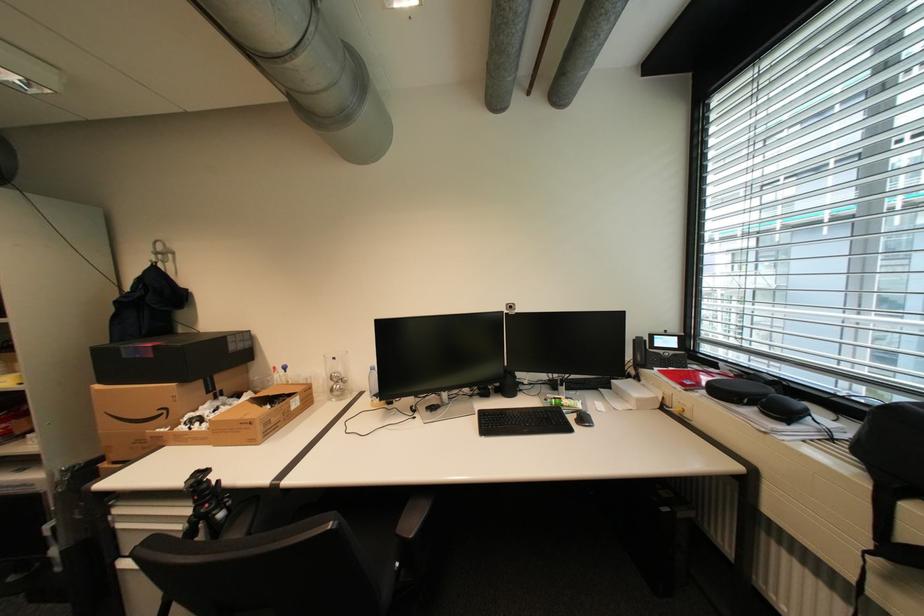
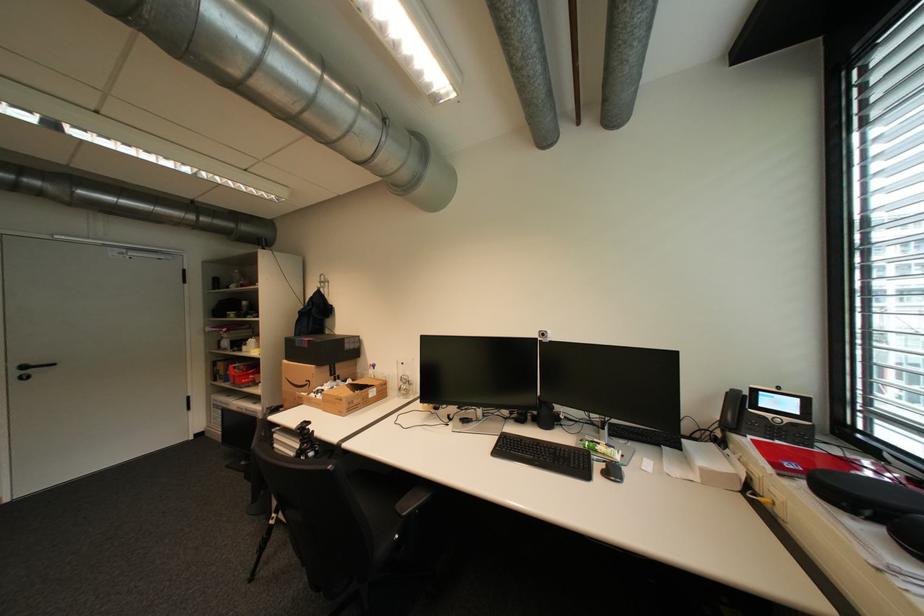
Where in the second image is the point corresponding to [174,411] from the first image?

(317, 383)